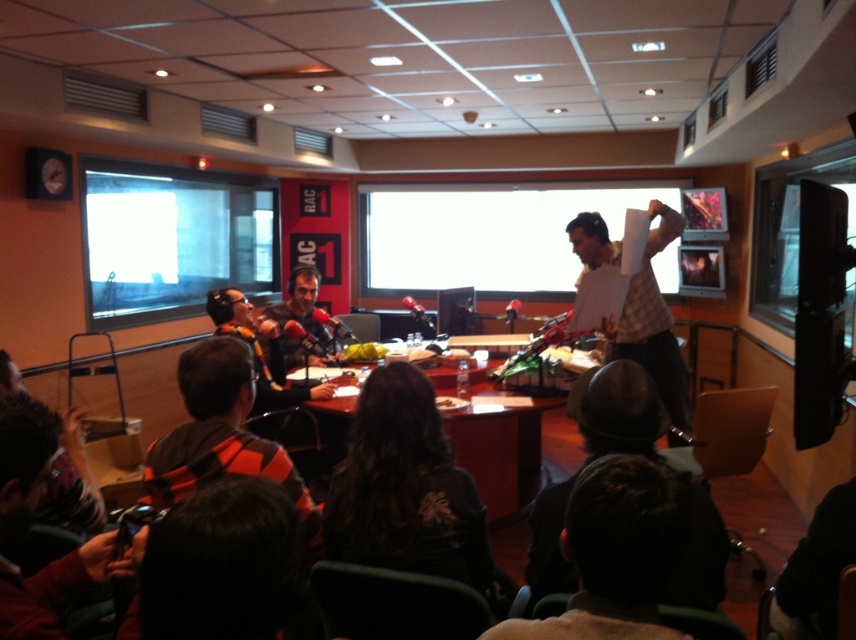
Which is behind, point (369, 257) or point (352, 412)?

Positioned behind is point (369, 257).

Who is more forward, (500, 204) or (490, 435)?

Positioned in front is point (490, 435).

This screenshot has height=640, width=856. What are the coordinates of `white paper at center` in the screenshot? It's located at (483, 234).

Which is below, white paper at center or plaid fabric shirt at center?

plaid fabric shirt at center is lower down.

Where is `white paper at center`? Image resolution: width=856 pixels, height=640 pixels. white paper at center is located at coordinates (483, 234).

Is point (164, 211) in front of point (631, 358)?

No, (164, 211) is further to viewer.

Which is in front, point (114, 314) or point (666, 401)?

Point (666, 401)

Find the location of `matte glass projection screen at upper left`. matte glass projection screen at upper left is located at coordinates (171, 237).

At what (x,y) coordinates should I click in order to perform the action: click on matte glass projection screen at upper left. Please return your answer as a coordinate pair (x, y). The width and height of the screenshot is (856, 640). Looking at the image, I should click on (171, 237).